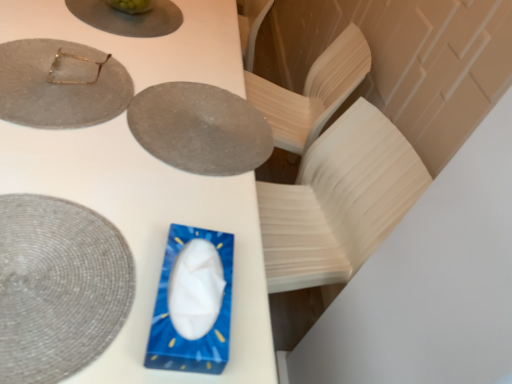
Locate an element on the screen. The width and height of the screenshot is (512, 384). empty space that is ontop of matte gray plate at upper center, the 4th plate positioned from the bottom (from a real-world perspective) is located at coordinates (133, 12).